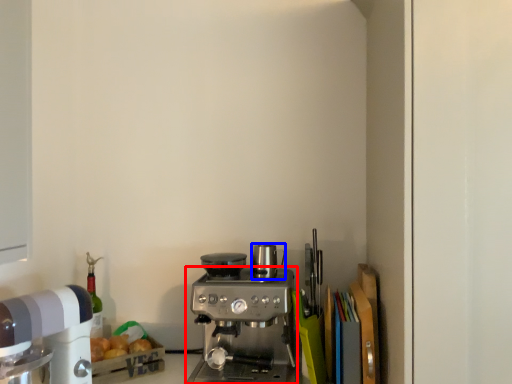
Question: Which of the following is the farthest to the observer, coffee maker (highlighted by a red box) or appliance (highlighted by a blue box)?

Choices:
 (A) coffee maker
 (B) appliance

Answer: (B)